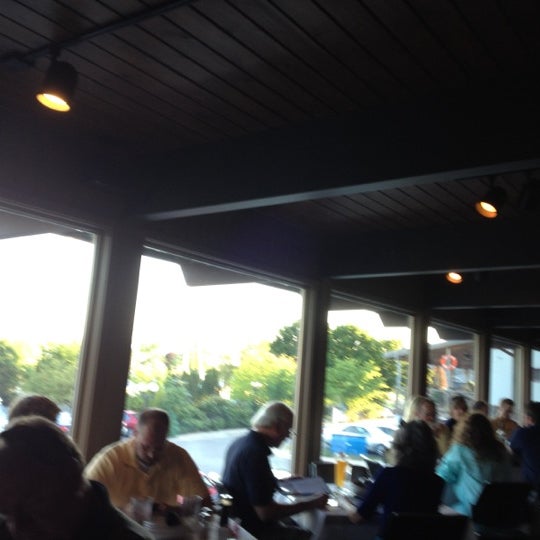
Identify the location of light. This screenshot has height=540, width=540. (66, 93), (492, 209), (454, 281).